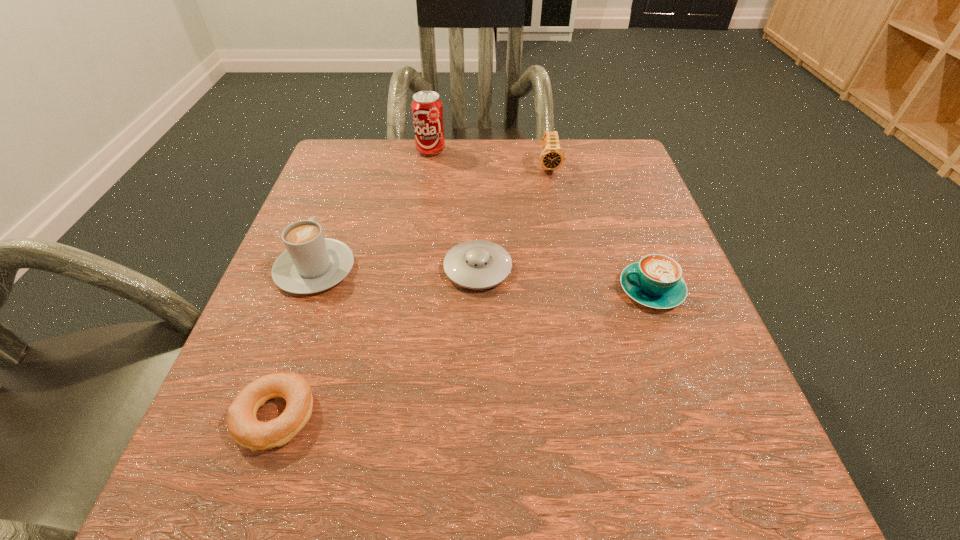
What are the coordinates of `object that is at the near edge` in the screenshot? It's located at (247, 431).

Image resolution: width=960 pixels, height=540 pixels. In order to click on cappuccino positioned at the left edge in this screenshot , I will do `click(311, 263)`.

Identify the location of bagel that is at the left edge. (247, 431).

Where is `object present at the right edge`? object present at the right edge is located at coordinates (656, 281).

Image resolution: width=960 pixels, height=540 pixels. Find the location of `object that is positioned at the near left corner`. object that is positioned at the near left corner is located at coordinates (247, 431).

The width and height of the screenshot is (960, 540). In order to click on vacant area at the far edge in this screenshot , I will do `click(411, 142)`.

This screenshot has height=540, width=960. In the image, there is a desktop. Identify the location of vacant space at the near edge. (492, 469).

This screenshot has width=960, height=540. I want to click on vacant region at the left edge of the desktop, so click(204, 430).

The image size is (960, 540). In the image, there is a desktop. Identify the location of vacant space at the right edge. (644, 218).

The width and height of the screenshot is (960, 540). Find the location of `free region at the far left corner`. free region at the far left corner is located at coordinates (347, 194).